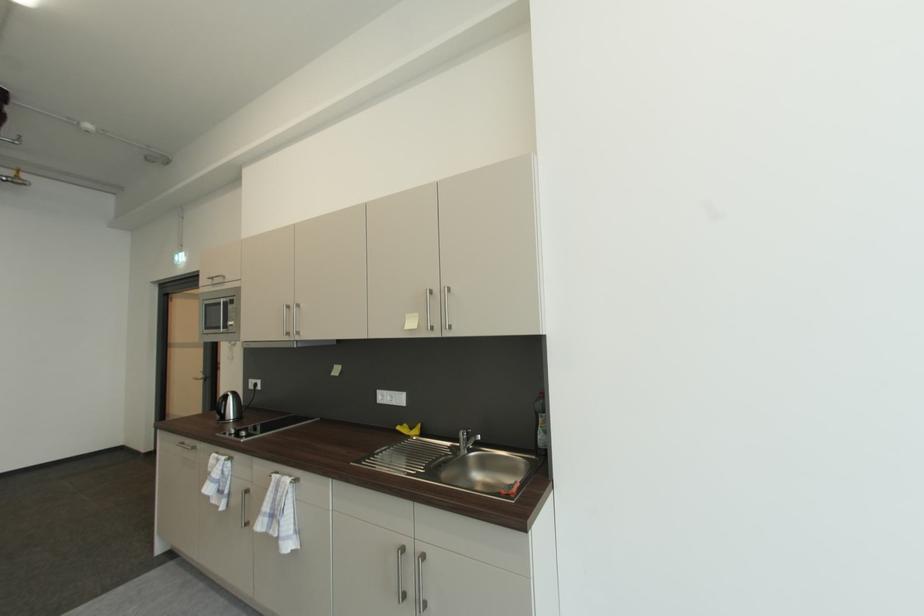
What do you see at coordinates (399, 573) in the screenshot? The width and height of the screenshot is (924, 616). I see `the door handle` at bounding box center [399, 573].